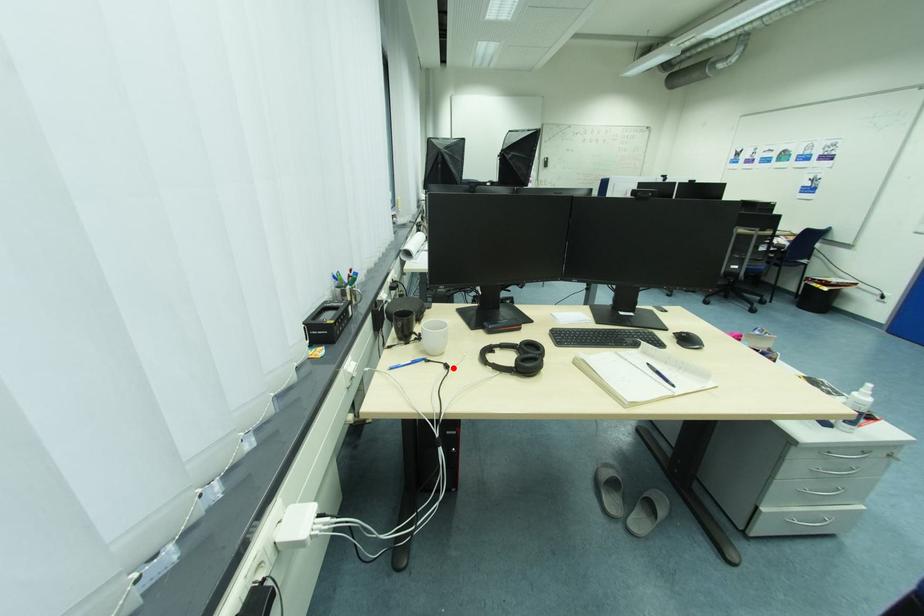
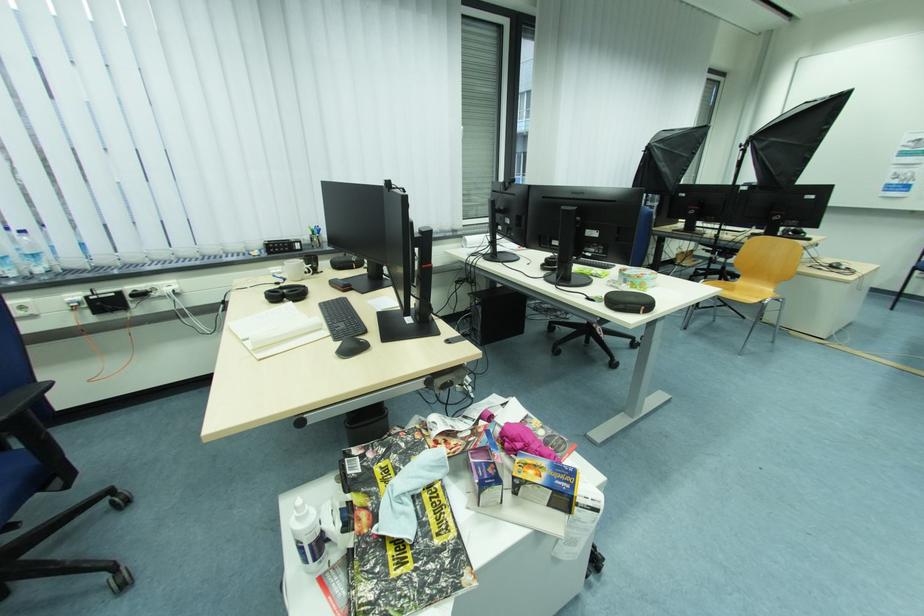
The point at the highlighted location is marked in the first image. Where is the corresponding point in the second image?

(284, 285)